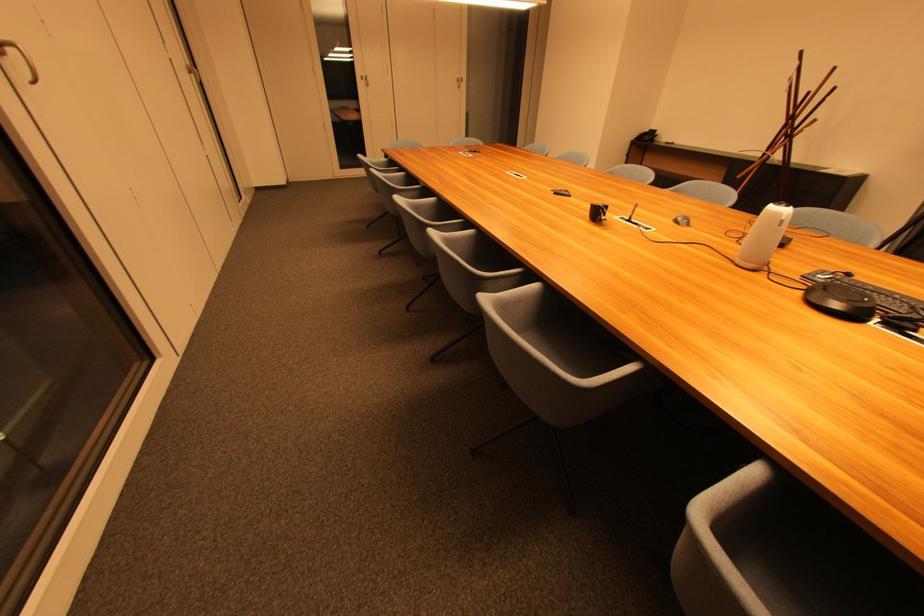
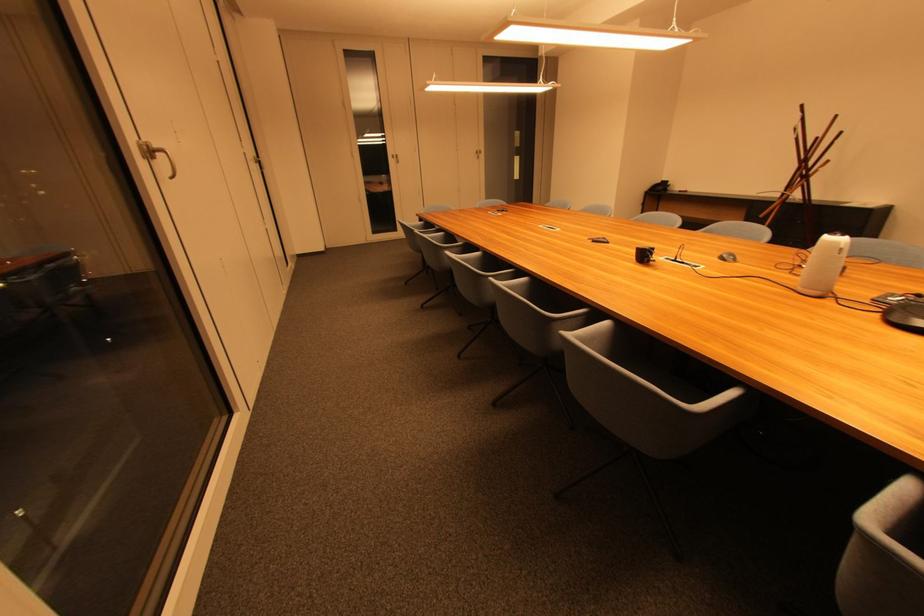
In the second image, find the point that corresponds to [190,73] in the first image.

(259, 163)